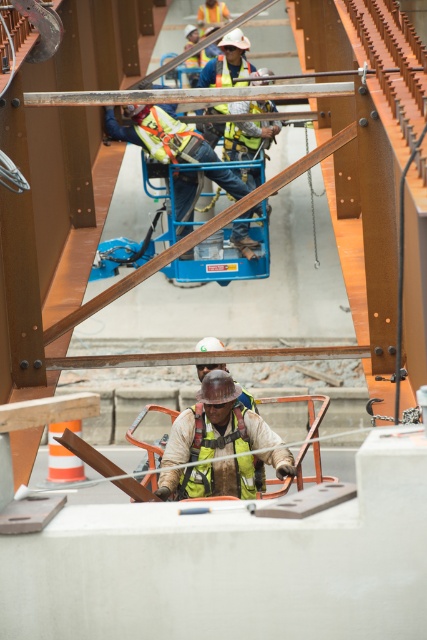
Between point (186, 141) and point (196, 468), which one is positioned behind?

The point (186, 141) is behind.

Is yellow reflective vest at center thinner than yellow high-visibility safety vest at center?

No.

Between point (184, 150) and point (236, 403), which one is positioned in front?

Positioned in front is point (236, 403).

You are a GUI agent. You are given a task and a screenshot of the screen. Output one action in this format:
    pyautogui.click(x=<x>, y=<y>)
    Task: Click on the yellow reflective vest at center
    
    Given the screenshot: What is the action you would take?
    pyautogui.click(x=160, y=132)

Identify the location of reflective yellow safety vest at center. The width and height of the screenshot is (427, 640). pos(216,424).

Which of these two, reflective yellow safety vest at center or yellow high-visibility safety vest at center, stands taller?

reflective yellow safety vest at center is taller.

Is point (245, 436) positioned before point (204, 465)?

No, it is not.

The height and width of the screenshot is (640, 427). Find the location of `reflective yellow safety vest at center`. reflective yellow safety vest at center is located at coordinates (216, 424).

Does reflective yellow safety vest at center have a greater width compared to yellow reflective vest at center?

In fact, reflective yellow safety vest at center might be narrower than yellow reflective vest at center.

Is reflective yellow safety vest at center further to camera compared to yellow reflective vest at center?

No, reflective yellow safety vest at center is closer to the viewer.

Which is behind, point (178, 436) or point (134, 116)?

Positioned behind is point (134, 116).

Where is `reflective yellow safety vest at center`? reflective yellow safety vest at center is located at coordinates (216, 424).